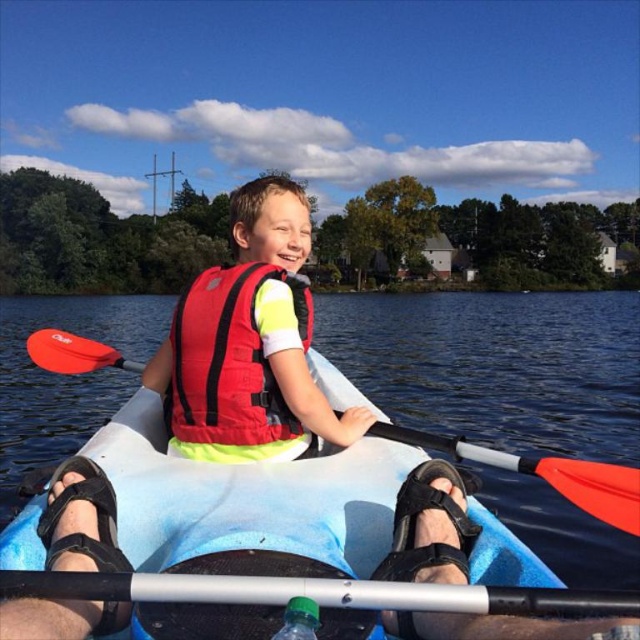
You are a photographer trying to capture the orange paddle at center and the green translucent bottle at lower center in the same frame. Based on their positions, which object should you focus on first to ensure both are in the shot?

The orange paddle at center is located below the green translucent bottle at lower center, so you should focus on the green translucent bottle at lower center first to ensure both are in the shot.

You are a photographer trying to capture the red nylon life jacket at center in your shot. Based on its 2D coordinates, where should you position your camera to ensure it is centered in the frame?

The red nylon life jacket at center is located at the 2D coordinates point (228,358), so positioning the camera to center the frame at those coordinates will ensure the life jacket is centered.